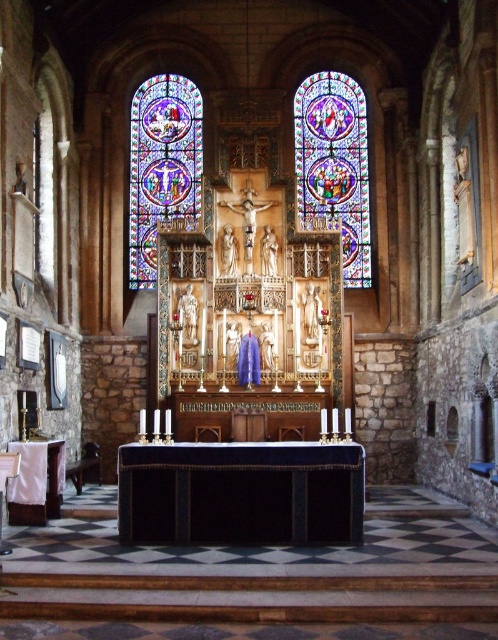
Question: Which of the following is the closest to the observer?

Choices:
 (A) (349, 109)
 (B) (168, 220)

Answer: (B)

Question: Observing the image, what is the correct spatial positioning of stained glass window at center in reference to stained glass window at left?

Choices:
 (A) left
 (B) right

Answer: (B)

Question: Is stained glass window at center to the left of stained glass window at left from the viewer's perspective?

Choices:
 (A) no
 (B) yes

Answer: (A)

Question: Among these objects, which one is farthest from the camera?

Choices:
 (A) stained glass window at left
 (B) stained glass window at center

Answer: (A)

Question: Is stained glass window at center to the right of stained glass window at left from the viewer's perspective?

Choices:
 (A) yes
 (B) no

Answer: (A)